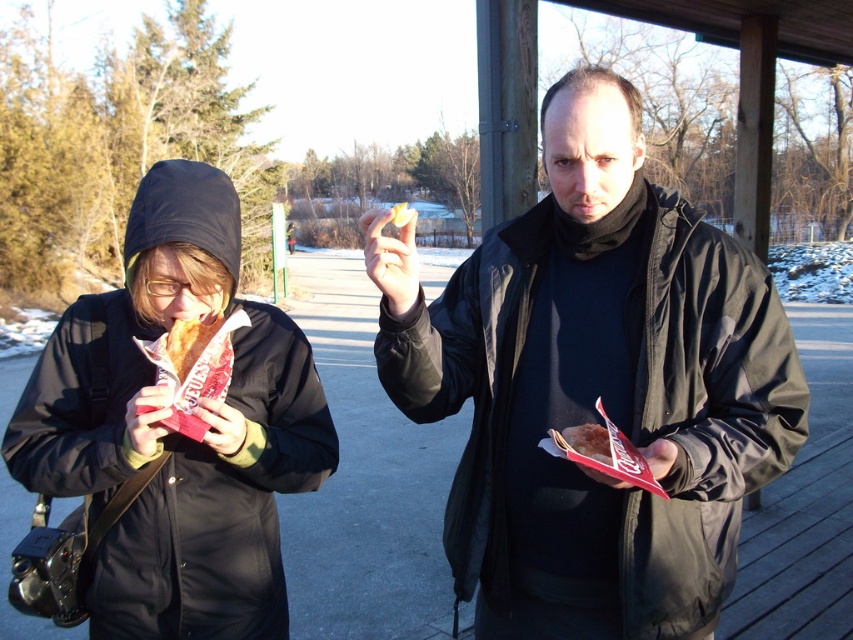
Please provide the 2D coordinates of the matte black jacket at left in the image. The coordinates should be in the format of a point with two decimal places, like 0.5,0.5.

The 2D coordinates of the matte black jacket at left are at point (171, 429).